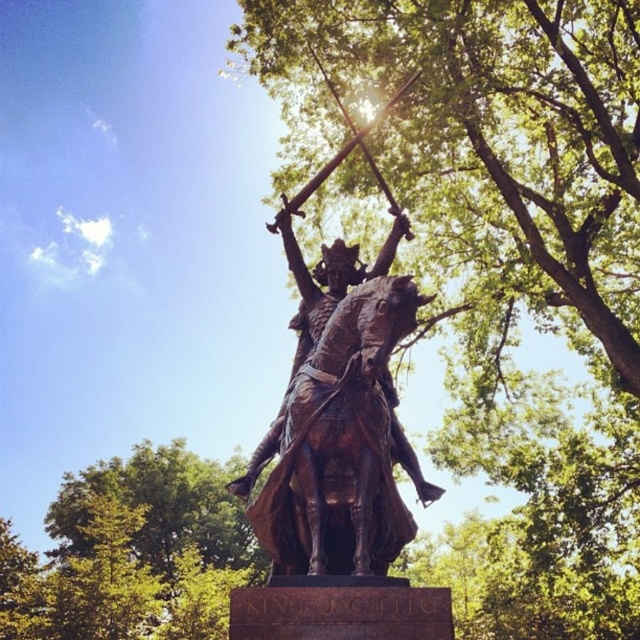
Question: Which point appears farthest from the camera in this image?

Choices:
 (A) (349, 188)
 (B) (378, 572)

Answer: (A)

Question: Is green leafy tree at upper center further to the viewer compared to bronze statue at center?

Choices:
 (A) no
 (B) yes

Answer: (B)

Question: Does green leafy tree at upper center have a larger size compared to bronze statue at center?

Choices:
 (A) yes
 (B) no

Answer: (A)

Question: Which point appears farthest from the camera in this image?

Choices:
 (A) (371, 397)
 (B) (490, 116)

Answer: (B)

Question: Can you confirm if green leafy tree at upper center is positioned below bronze statue at center?

Choices:
 (A) no
 (B) yes

Answer: (B)